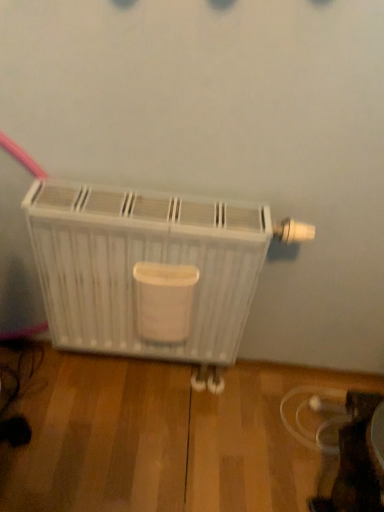
The width and height of the screenshot is (384, 512). I want to click on white plastic radiator at center, so click(x=144, y=260).

Measure the distance between point (201,331) and camera.

Point (201,331) is 3.72 feet from camera.

What do you see at coordinates (144, 260) in the screenshot? I see `white plastic radiator at center` at bounding box center [144, 260].

Measure the distance between white plastic radiator at center and camera.

white plastic radiator at center is 34.68 inches from camera.

You are a GUI agent. You are given a task and a screenshot of the screen. Output one action in this format:
    pyautogui.click(x=<x>, y=<y>)
    Task: Click on the white plastic radiator at center
    The height and width of the screenshot is (512, 384).
    Given the screenshot: What is the action you would take?
    pyautogui.click(x=144, y=260)